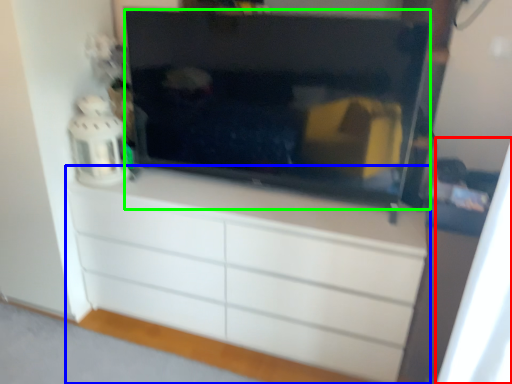
Question: Based on their relative distances, which object is farther from curtain (highlighted by a red box)? Choose from chest of drawers (highlighted by a blue box) and television (highlighted by a green box).

Choices:
 (A) chest of drawers
 (B) television

Answer: (B)